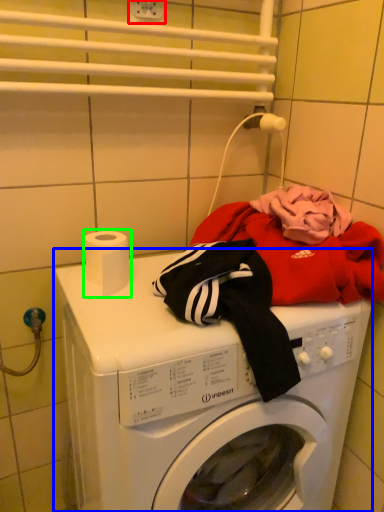
Question: Considering the real-world distances, which object is farthest from electric outlet (highlighted by a red box)? washing machine (highlighted by a blue box) or toilet paper (highlighted by a green box)?

Choices:
 (A) washing machine
 (B) toilet paper

Answer: (A)